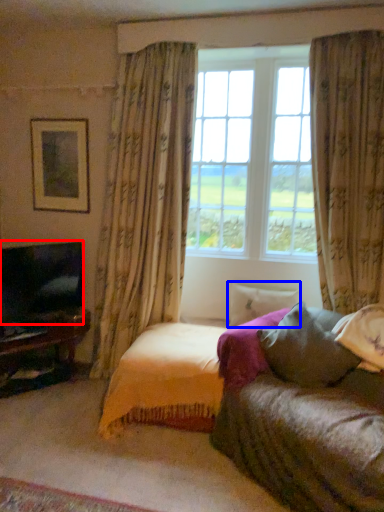
Question: Which of the following is the closest to the observer, television (highlighted by a red box) or pillow (highlighted by a blue box)?

Choices:
 (A) television
 (B) pillow

Answer: (A)